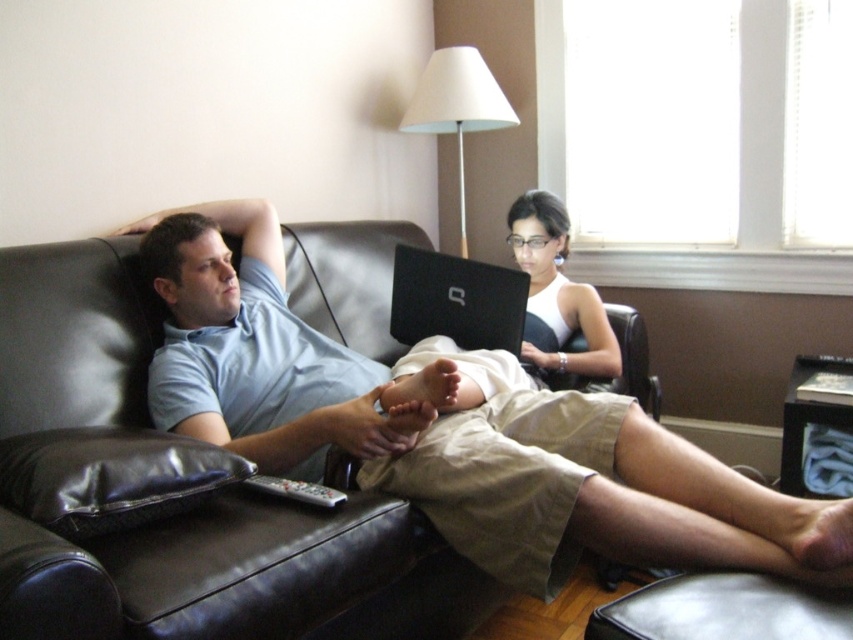
Is light blue cotton shirt at center below gray plastic remote at lower center?

Incorrect, light blue cotton shirt at center is not positioned below gray plastic remote at lower center.

Does light blue cotton shirt at center appear on the left side of gray plastic remote at lower center?

Incorrect, light blue cotton shirt at center is not on the left side of gray plastic remote at lower center.

Where is `light blue cotton shirt at center`? The image size is (853, 640). light blue cotton shirt at center is located at coordinates (552, 480).

Can you confirm if light blue cotton shirt at center is positioned to the right of black matte laptop at center?

No, light blue cotton shirt at center is not to the right of black matte laptop at center.

Is light blue cotton shirt at center positioned behind black matte laptop at center?

No, light blue cotton shirt at center is in front of black matte laptop at center.

The width and height of the screenshot is (853, 640). Identify the location of light blue cotton shirt at center. (552, 480).

Between white glossy tank top at center and gray plastic remote at lower center, which one has less height?

gray plastic remote at lower center is shorter.

Is white glossy tank top at center to the right of gray plastic remote at lower center from the viewer's perspective?

Correct, you'll find white glossy tank top at center to the right of gray plastic remote at lower center.

Between point (514, 237) and point (311, 484), which one is positioned behind?

Point (514, 237)

Identify the location of white glossy tank top at center. The width and height of the screenshot is (853, 640). (558, 291).